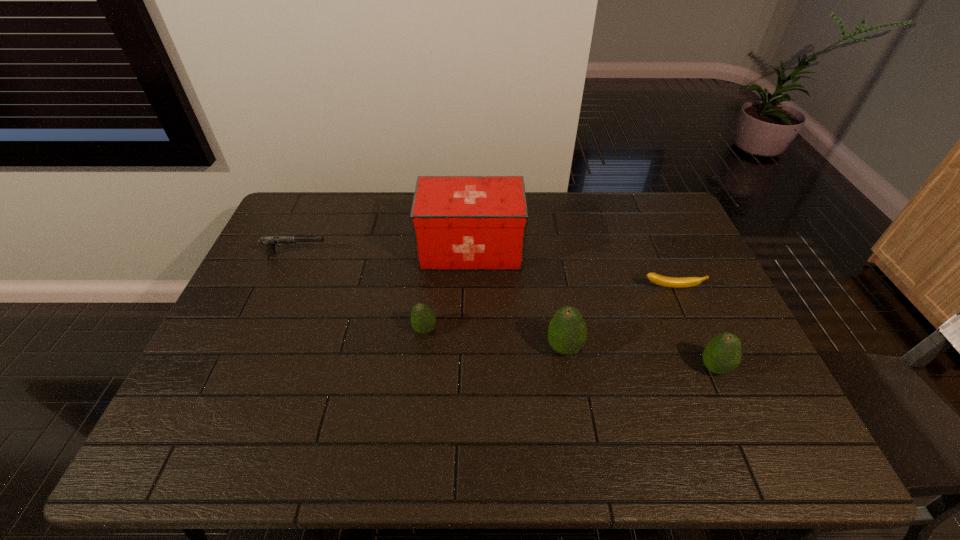
Find the location of a particular element. This screenshot has height=540, width=960. vacant point that satisfies the following two spatial constraints: 1. on the handle side of the tallest avocado; 2. on the right side of the first-aid kit is located at coordinates (468, 348).

This screenshot has width=960, height=540. What are the coordinates of `vacant space that satisfies the following two spatial constraints: 1. at the muzzle end of the rightmost avocado; 2. on the left side of the fifth tallest object` in the screenshot? It's located at (247, 368).

Locate an element on the screen. The height and width of the screenshot is (540, 960). vacant area that satisfies the following two spatial constraints: 1. on the back side of the second tallest avocado; 2. on the handle side of the tallest object is located at coordinates (661, 249).

The width and height of the screenshot is (960, 540). In order to click on free point that satisfies the following two spatial constraints: 1. on the front side of the leftmost avocado; 2. on the left side of the fourth shortest object in this screenshot , I will do `click(420, 368)`.

Locate an element on the screen. This screenshot has width=960, height=540. free space in the image that satisfies the following two spatial constraints: 1. on the handle side of the tallest object; 2. on the left side of the second avocado from right to left is located at coordinates point(468,348).

In order to click on vacant space that satisfies the following two spatial constraints: 1. on the handle side of the tallest object; 2. on the back side of the tallest avocado in this screenshot , I will do `click(468, 348)`.

I want to click on free space in the image that satisfies the following two spatial constraints: 1. on the handle side of the first-aid kit; 2. on the back side of the third object from right to left, so click(468, 348).